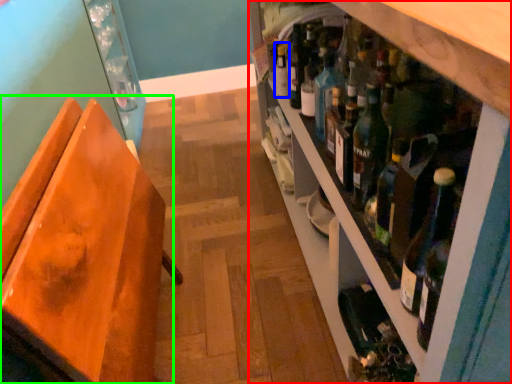
Question: Which object is the farthest from shelf (highlighted by a red box)? Choose among these: bottle (highlighted by a blue box) or chair (highlighted by a green box).

Choices:
 (A) bottle
 (B) chair

Answer: (B)